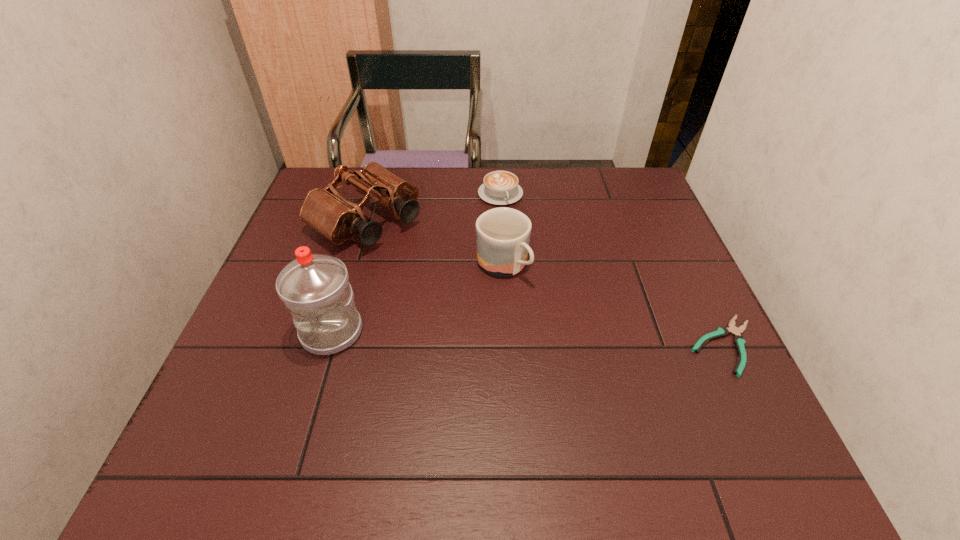
You are a GUI agent. You are given a task and a screenshot of the screen. Output one action in this format:
    pyautogui.click(x=<x>, y=<y>)
    Task: Click on the binoculars that is positioned at the left edge
    
    Given the screenshot: What is the action you would take?
    pyautogui.click(x=325, y=210)

In order to click on object located in the right edge section of the desktop in this screenshot , I will do click(x=739, y=341).

Identify the location of object that is at the far left corner. The image size is (960, 540). tap(325, 210).

Identify the location of vacant space at the far edge of the desktop. (552, 178).

Image resolution: width=960 pixels, height=540 pixels. Identify the location of vacant space at the left edge of the desktop. (324, 241).

The height and width of the screenshot is (540, 960). I want to click on vacant space at the right edge of the desktop, so click(659, 217).

Where is `free space at the near left corner of the desktop`? Image resolution: width=960 pixels, height=540 pixels. free space at the near left corner of the desktop is located at coordinates (266, 404).

Locate an element on the screen. This screenshot has height=540, width=960. vacant area at the far right corner of the desktop is located at coordinates (616, 187).

Where is `blank region between the binoculars and the rightmost object`? The image size is (960, 540). blank region between the binoculars and the rightmost object is located at coordinates (545, 282).

Where is `free space between the second tallest object and the tallest object`? free space between the second tallest object and the tallest object is located at coordinates (349, 276).